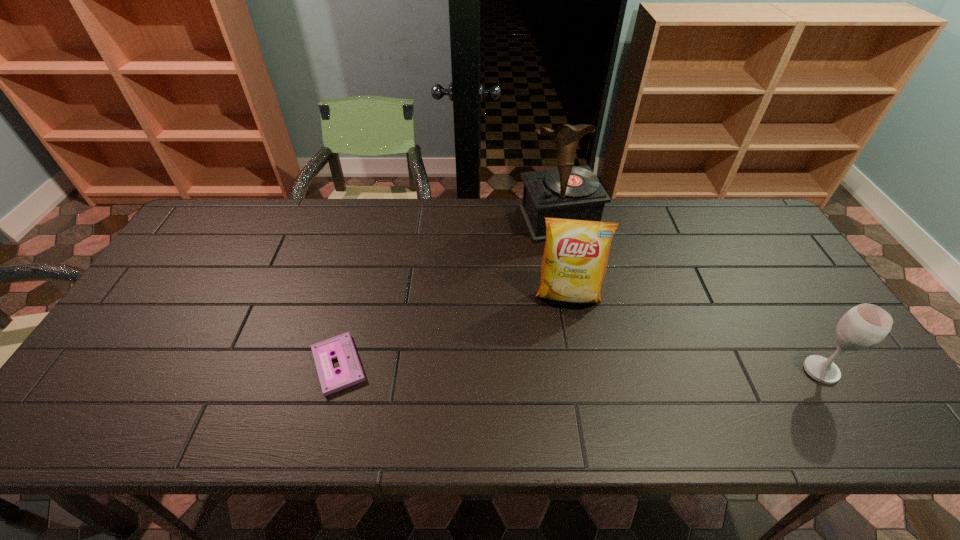
The width and height of the screenshot is (960, 540). I want to click on free point between the rightmost object and the leftmost object, so click(580, 367).

Identify the location of vacant point located between the second shortest object and the leftmost object. (580, 367).

Locate which object ranks in proximity to the third nearest object. Please provide its 2D coordinates. Your answer should be formatted as a tuple, i.e. [(x, y)], where the tuple contains the x and y coordinates of a point satisfying the conditions above.

[(567, 192)]

Locate which object is the third closest to the wineglass. Please provide its 2D coordinates. Your answer should be formatted as a tuple, i.e. [(x, y)], where the tuple contains the x and y coordinates of a point satisfying the conditions above.

[(350, 373)]

Identify the location of vacant space that satisfies the following two spatial constraints: 1. on the front side of the videotape; 2. on the left side of the rightmost object. The width and height of the screenshot is (960, 540). (337, 370).